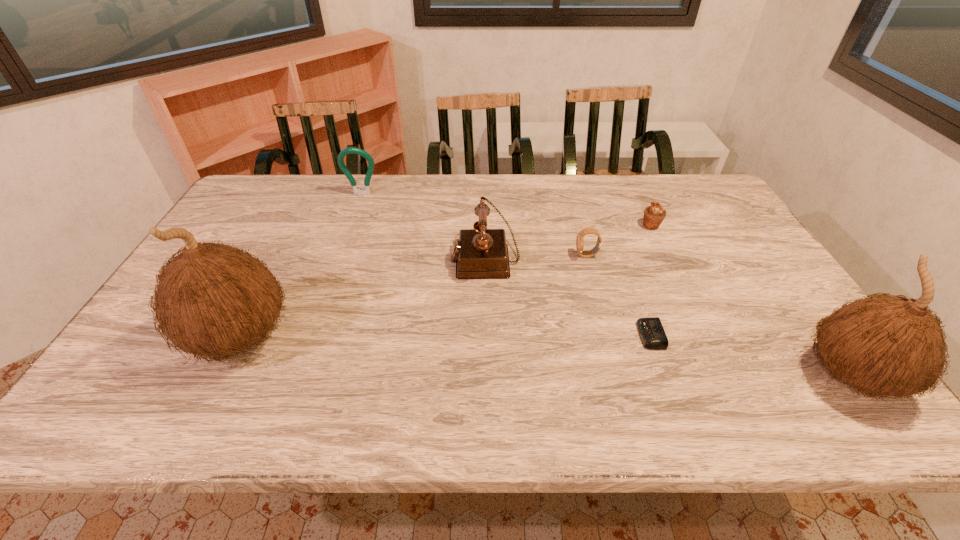
Locate an element on the screen. This screenshot has width=960, height=540. free space between the third object from right to left and the watch is located at coordinates (618, 295).

Image resolution: width=960 pixels, height=540 pixels. Identify the location of vacant area that lies between the third object from left to right and the watch. (x=536, y=256).

Locate an element on the screen. The width and height of the screenshot is (960, 540). vacant space that is in between the telephone and the bottle opener is located at coordinates (423, 226).

I want to click on object that can be found as the closest to the right coconut, so click(x=652, y=334).

Identify the location of object that can be found as the fourth closest to the watch. This screenshot has height=540, width=960. (887, 345).

This screenshot has width=960, height=540. I want to click on blank area in the image that satisfies the following two spatial constraints: 1. at the jaws of the second farthest object; 2. on the left side of the bottle opener, so click(x=351, y=226).

You are a GUI agent. You are given a task and a screenshot of the screen. Output one action in this format:
    pyautogui.click(x=<x>, y=<y>)
    Task: Click on the free point that satisfies the following two spatial constraints: 1. at the jaws of the farthest object; 2. on the surface of the taller coconut
    This screenshot has height=540, width=960.
    Given the screenshot: What is the action you would take?
    pyautogui.click(x=311, y=338)

Locate an element on the screen. Image resolution: width=960 pixels, height=540 pixels. vacant space that satisfies the following two spatial constraints: 1. on the front side of the sixth object from left to right; 2. on the surface of the taller coconut is located at coordinates (705, 338).

This screenshot has width=960, height=540. Find the location of `free space that satisfies the following two spatial constraints: 1. on the front side of the sixth nearest object; 2. on the face of the fourth object from right to left`. free space that satisfies the following two spatial constraints: 1. on the front side of the sixth nearest object; 2. on the face of the fourth object from right to left is located at coordinates point(665,255).